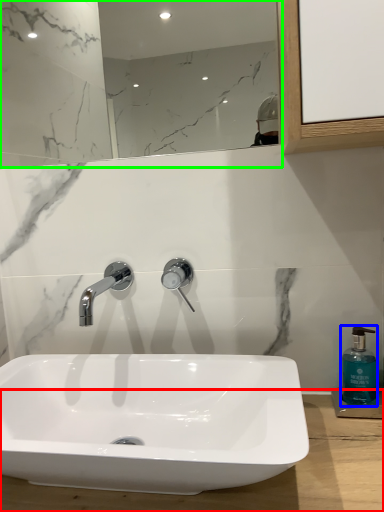
Question: Which is farther away from counter top (highlighted by a red box)? soap dispenser (highlighted by a blue box) or mirror (highlighted by a green box)?

Choices:
 (A) soap dispenser
 (B) mirror

Answer: (B)